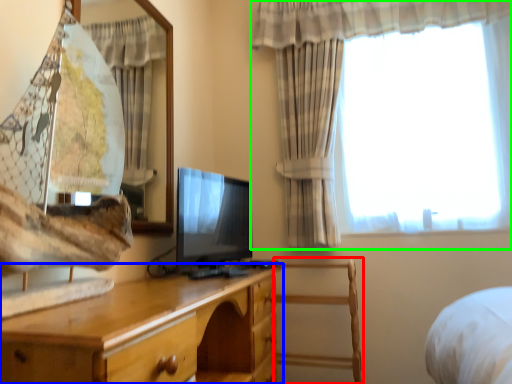
Question: Based on their relative distances, which object is farther from chair (highlighted by a red box)? Choose from chest of drawers (highlighted by a blue box) and curtain (highlighted by a green box).

Choices:
 (A) chest of drawers
 (B) curtain

Answer: (A)